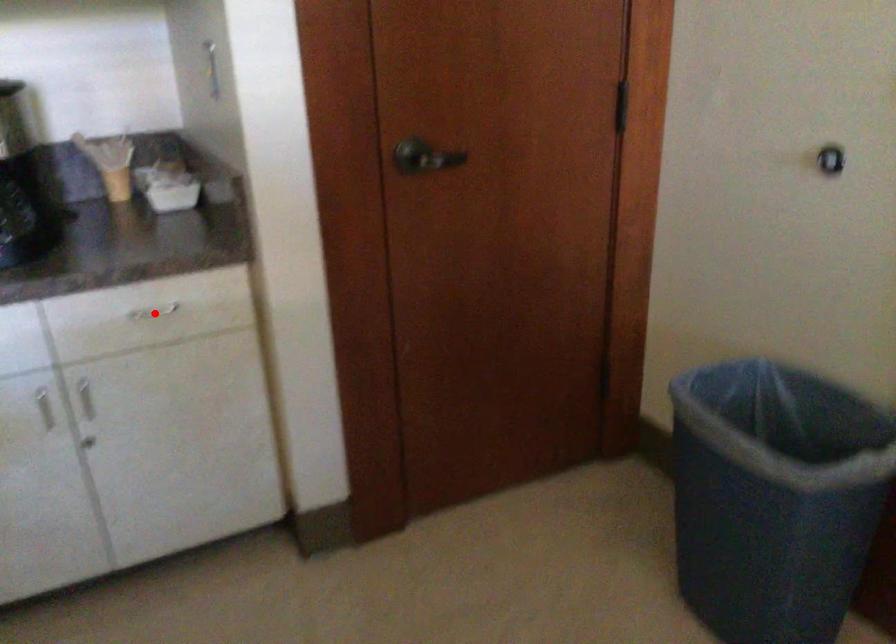
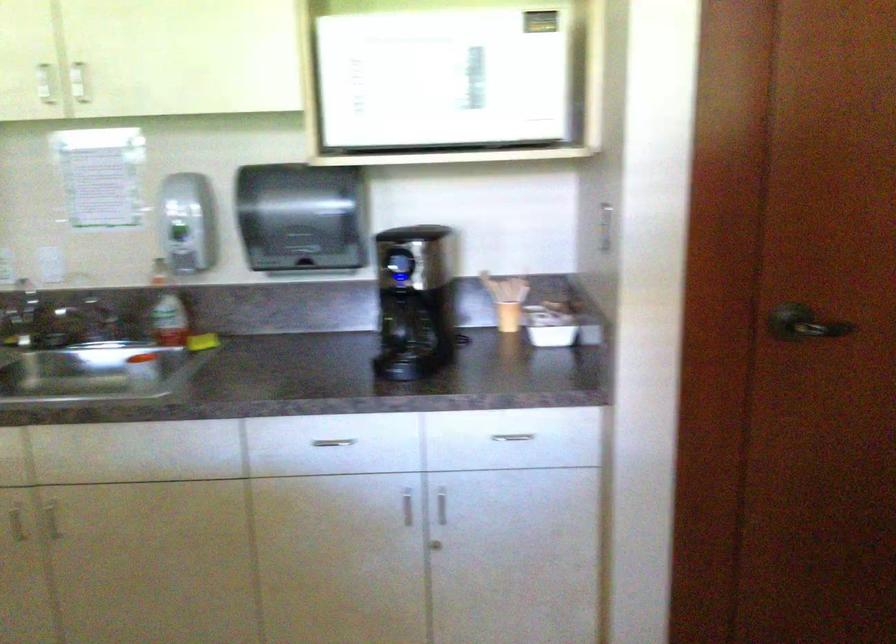
Question: I am providing you with two images of the same scene from different viewpoints. A red point is marked on the first image. Is the red point's position out of view in image 2?

Choices:
 (A) Yes
 (B) No

Answer: (B)